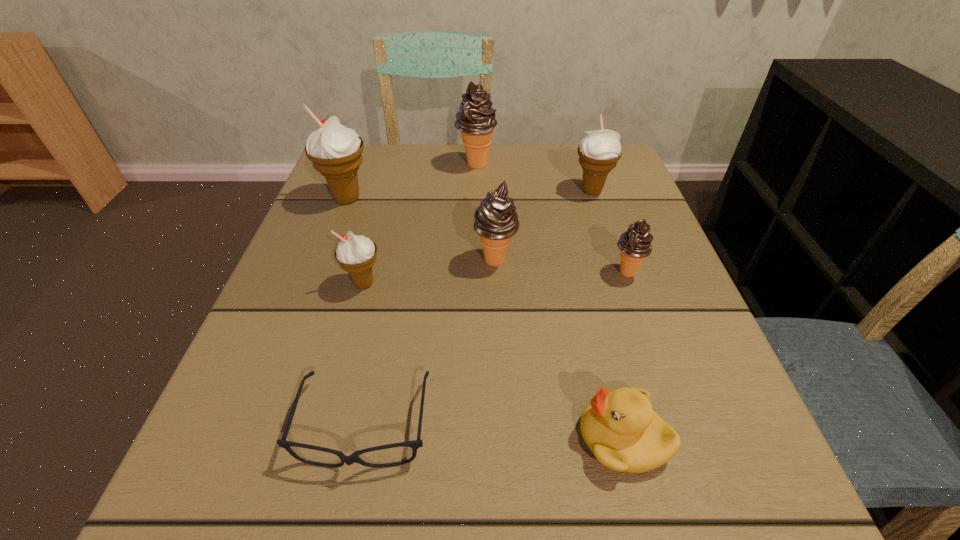
You are a GUI agent. You are given a task and a screenshot of the screen. Output one action in this format:
    pyautogui.click(x=<x>, y=<y>)
    Task: Click on the biggest chocolate icecream
    The height and width of the screenshot is (540, 960).
    Given the screenshot: What is the action you would take?
    pyautogui.click(x=476, y=121)

Where is `the farthest chocolate icecream`? The image size is (960, 540). the farthest chocolate icecream is located at coordinates pyautogui.click(x=476, y=121).

The width and height of the screenshot is (960, 540). I want to click on the biggest white icecream, so click(336, 151).

Image resolution: width=960 pixels, height=540 pixels. What are the coordinates of `the second smallest white icecream` in the screenshot? It's located at (599, 152).

You are a GUI agent. You are given a task and a screenshot of the screen. Output one action in this format:
    pyautogui.click(x=<x>, y=<y>)
    Task: Click on the second biggest chocolate icecream
    The width and height of the screenshot is (960, 540).
    Given the screenshot: What is the action you would take?
    pyautogui.click(x=496, y=221)

Locate an element on the screen. The width and height of the screenshot is (960, 540). the nearest white icecream is located at coordinates (356, 254).

The image size is (960, 540). I want to click on the rightmost chocolate icecream, so click(635, 244).

Locate an element on the screen. This screenshot has height=540, width=960. duckling is located at coordinates (620, 428).

The height and width of the screenshot is (540, 960). I want to click on the second shortest object, so click(x=620, y=428).

Identify the location of the shortest object. (415, 444).